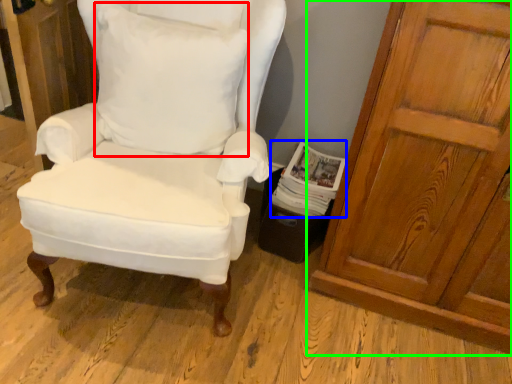
Question: Which is nearer to the pillow (highlighted by a red box)? magazine (highlighted by a blue box) or door (highlighted by a green box).

Choices:
 (A) magazine
 (B) door

Answer: (A)